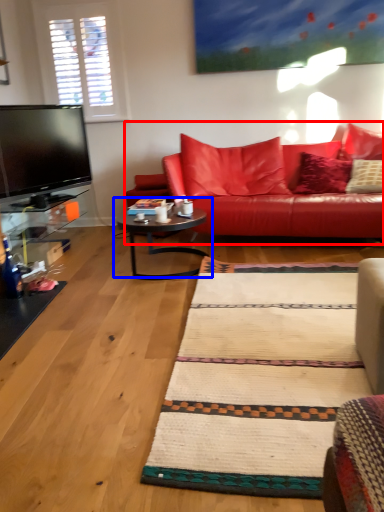
Question: Which of the following is the closest to the observer, studio couch (highlighted by a red box) or coffee table (highlighted by a blue box)?

Choices:
 (A) studio couch
 (B) coffee table

Answer: (B)